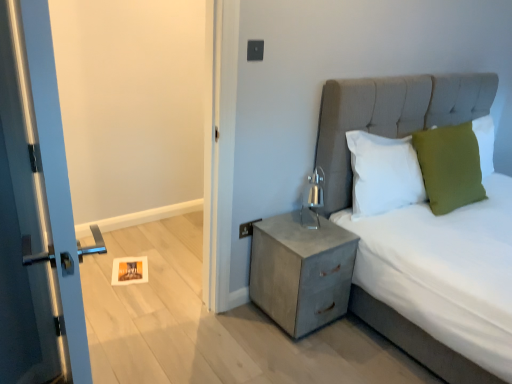
Question: Is metallic gray electric outlet at upper right aimed at green fabric pillow at upper right, positioned as the third pillow in left-to-right order?

Choices:
 (A) yes
 (B) no

Answer: (B)

Question: Is metallic gray electric outlet at upper right turned away from green fabric pillow at upper right, arranged as the 1th pillow when viewed from the right?

Choices:
 (A) yes
 (B) no

Answer: (B)

Question: Is green fabric pillow at upper right, positioned as the third pillow in left-to-right order, located within metallic gray electric outlet at upper right?

Choices:
 (A) yes
 (B) no

Answer: (B)

Question: Considering the relative sizes of metallic gray electric outlet at upper right and green fabric pillow at upper right, positioned as the third pillow in left-to-right order, in the image provided, is metallic gray electric outlet at upper right thinner than green fabric pillow at upper right, positioned as the third pillow in left-to-right order,?

Choices:
 (A) no
 (B) yes

Answer: (B)

Question: Is metallic gray electric outlet at upper right outside of green fabric pillow at upper right, arranged as the 1th pillow when viewed from the right?

Choices:
 (A) no
 (B) yes

Answer: (B)

Question: Considering the positions of metallic gray nightstand at lower right and metallic gray electric outlet at upper right in the image, is metallic gray nightstand at lower right bigger or smaller than metallic gray electric outlet at upper right?

Choices:
 (A) big
 (B) small

Answer: (A)

Question: In terms of width, does metallic gray nightstand at lower right look wider or thinner when compared to metallic gray electric outlet at upper right?

Choices:
 (A) wide
 (B) thin

Answer: (A)

Question: Is metallic gray nightstand at lower right taller or shorter than metallic gray electric outlet at upper right?

Choices:
 (A) short
 (B) tall

Answer: (B)

Question: Does point [x=342, y=230] appear closer or farther from the camera than point [x=244, y=226]?

Choices:
 (A) farther
 (B) closer

Answer: (A)

Question: Is metallic silver door at left wider or thinner than green fabric pillow at upper right, positioned as the third pillow in left-to-right order?

Choices:
 (A) thin
 (B) wide

Answer: (A)

Question: Is metallic silver door at left inside the boundaries of green fabric pillow at upper right, arranged as the 1th pillow when viewed from the right, or outside?

Choices:
 (A) outside
 (B) inside

Answer: (A)

Question: Is point (53, 104) positioned closer to the camera than point (485, 120)?

Choices:
 (A) farther
 (B) closer

Answer: (B)

Question: From the image's perspective, is metallic silver door at left located above or below green fabric pillow at upper right, positioned as the third pillow in left-to-right order?

Choices:
 (A) below
 (B) above

Answer: (A)

Question: Choose the correct answer: Is metallic silver door at left inside green fabric pillow at upper right, the 2th pillow when ordered from left to right, or outside it?

Choices:
 (A) outside
 (B) inside

Answer: (A)

Question: Relative to green fabric pillow at upper right, the 2th pillow when ordered from left to right, is metallic silver door at left in front or behind?

Choices:
 (A) front
 (B) behind

Answer: (A)